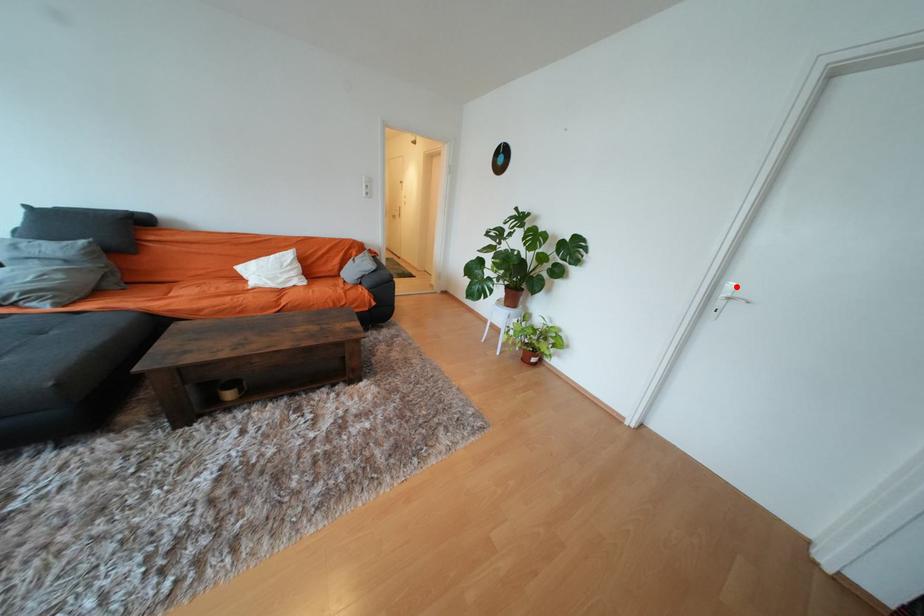
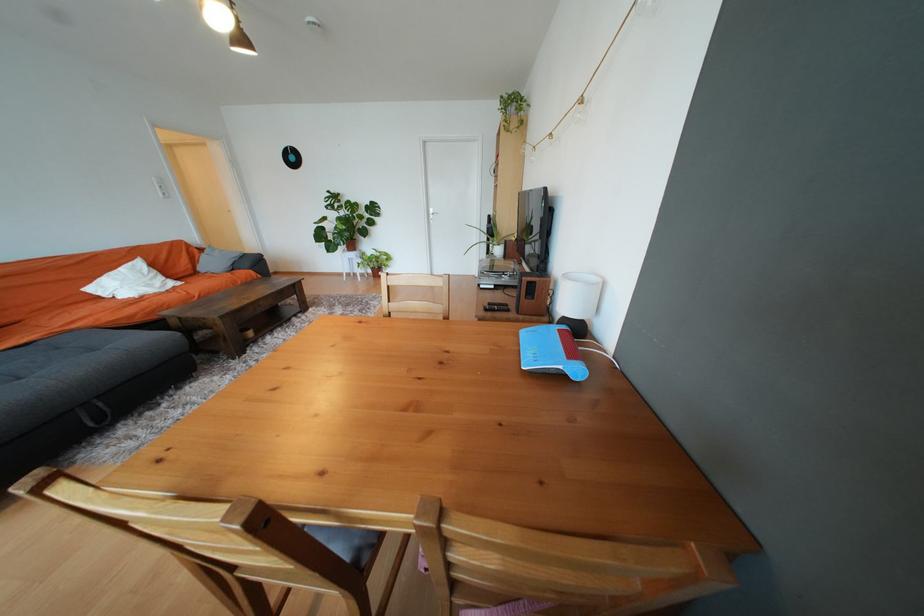
Locate, in the second image, the point that corresponds to the highlighted location in the first image.

(438, 211)